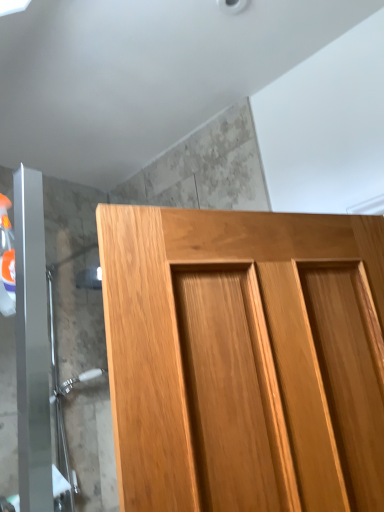
Question: Can you confirm if light brown wood door at center is bigger than satin nickel shower door at lower left?

Choices:
 (A) no
 (B) yes

Answer: (B)

Question: Is light brown wood door at center thinner than satin nickel shower door at lower left?

Choices:
 (A) no
 (B) yes

Answer: (A)

Question: Is light brown wood door at center turned away from satin nickel shower door at lower left?

Choices:
 (A) yes
 (B) no

Answer: (A)

Question: Is light brown wood door at center taller than satin nickel shower door at lower left?

Choices:
 (A) yes
 (B) no

Answer: (B)

Question: Is light brown wood door at center wider than satin nickel shower door at lower left?

Choices:
 (A) yes
 (B) no

Answer: (A)

Question: From the image's perspective, is light brown wood door at center over satin nickel shower door at lower left?

Choices:
 (A) no
 (B) yes

Answer: (B)

Question: From the image's perspective, is satin nickel shower door at lower left over light brown wood door at center?

Choices:
 (A) yes
 (B) no

Answer: (B)

Question: From a real-world perspective, is satin nickel shower door at lower left below light brown wood door at center?

Choices:
 (A) no
 (B) yes

Answer: (A)

Question: Considering the relative sizes of satin nickel shower door at lower left and light brown wood door at center in the image provided, is satin nickel shower door at lower left taller than light brown wood door at center?

Choices:
 (A) no
 (B) yes

Answer: (B)

Question: Is satin nickel shower door at lower left surrounding light brown wood door at center?

Choices:
 (A) no
 (B) yes

Answer: (A)

Question: Does satin nickel shower door at lower left turn towards light brown wood door at center?

Choices:
 (A) no
 (B) yes

Answer: (B)

Question: Is satin nickel shower door at lower left to the right of light brown wood door at center from the viewer's perspective?

Choices:
 (A) no
 (B) yes

Answer: (A)

Question: From a real-world perspective, is light brown wood door at center physically located above or below satin nickel shower door at lower left?

Choices:
 (A) below
 (B) above

Answer: (A)